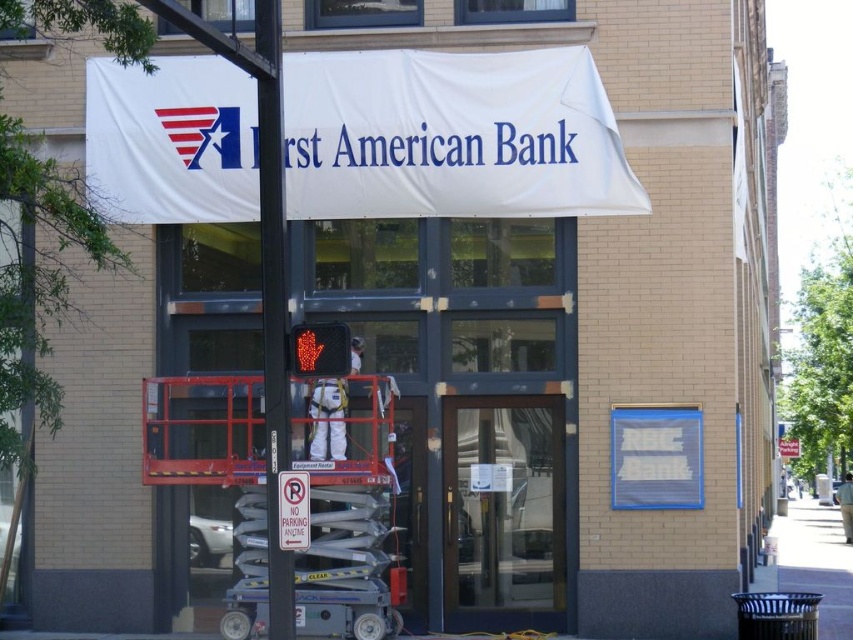
You are standing at the entrance of the building. There is a point marked at coordinates [460,403]. What is located at that point?

The point at coordinates [460,403] marks the clear glass door at center.